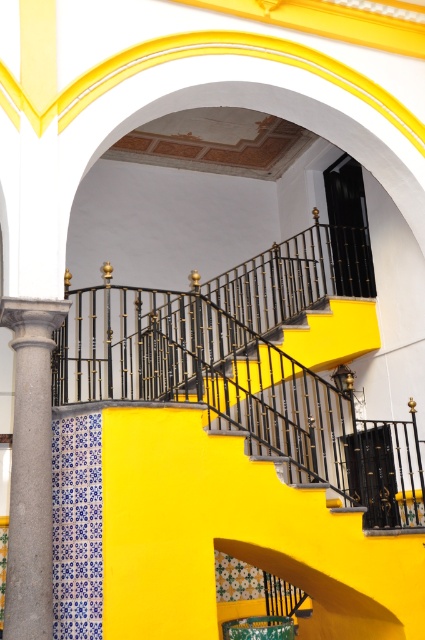
Is gray stone column at left thinner than black wrought iron balustrade at center?

Correct, gray stone column at left's width is less than black wrought iron balustrade at center's.

Is gray stone column at left positioned at the back of black wrought iron balustrade at center?

No.

Is point (45, 593) positioned before point (325, 275)?

Yes, it is in front of point (325, 275).

Where is `gray stone column at left`? Image resolution: width=425 pixels, height=640 pixels. gray stone column at left is located at coordinates (31, 468).